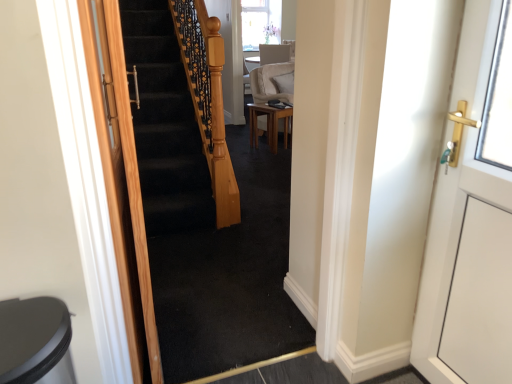
Locate an element on the screen. The image size is (512, 384). blank area to the left of black carpeted stairs at center is located at coordinates (196, 356).